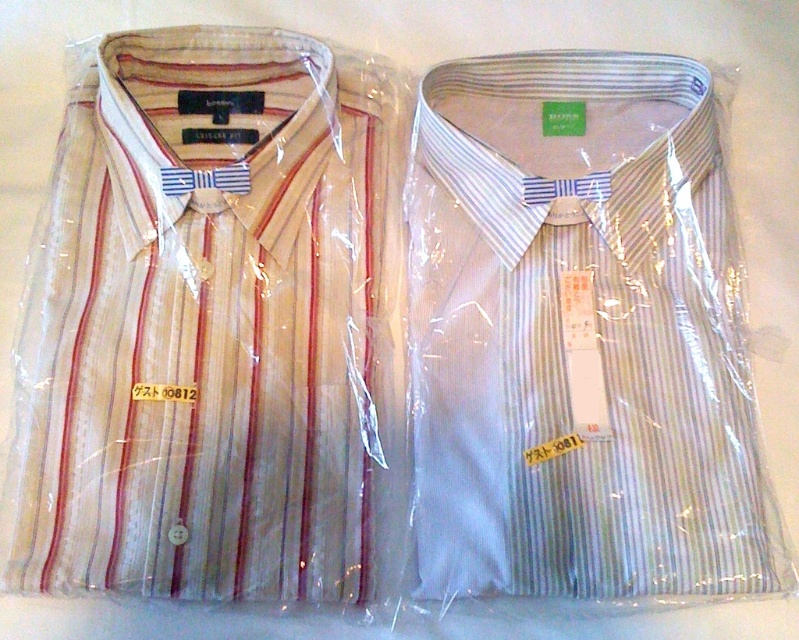
You are a customer trying to decide between the white striped shirt at left and the light blue striped shirt at center. If you want to pick up both shirts from the display, can you comfortably reach both while standing in front of them?

The white striped shirt at left and the light blue striped shirt at center are 10.59 inches apart, so you can comfortably reach both while standing in front of them since the distance between them is manageable for a person to reach without needing to move their position.

You are a customer at a clothing store and want to buy a shirt that fits your size. You see the white striped shirt at left and the light blue striped shirt at center. Which one is bigger in size?

The white striped shirt at left has a larger size compared to the light blue striped shirt at center, so the white striped shirt at left is bigger in size.